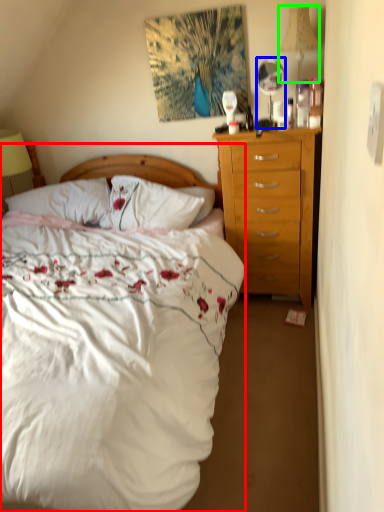
Question: Based on their relative distances, which object is nearer to bed (highlighted by a red box)? Choose from mirror (highlighted by a blue box) and lamp (highlighted by a green box).

Choices:
 (A) mirror
 (B) lamp

Answer: (A)